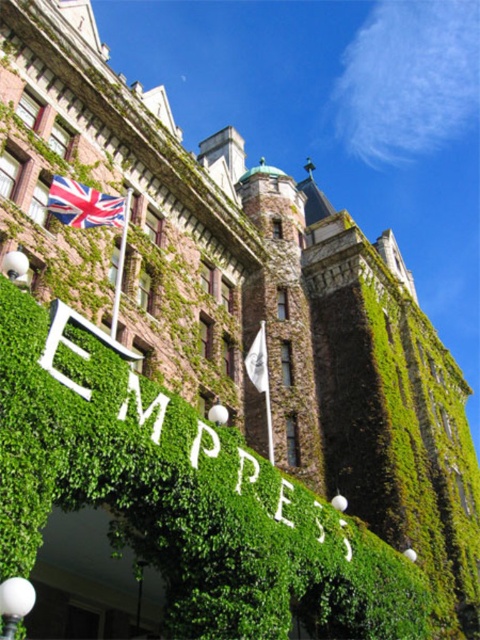
You are standing in front of the historic building and want to hang a new flag between the union jack fabric flag at upper left and the white fabric flag at center. The new flag requires a space of 2 meters. Is there enough space between them?

The union jack fabric flag at upper left and white fabric flag at center are 18.01 meters apart from each other, so yes, there is enough space between them to hang the new flag requiring 2 meters.

You are standing in front of the historic building and notice two flags. The union jack fabric flag at upper left and the white fabric flag at center. Which flag is shorter in height?

The union jack fabric flag at upper left has a lesser height compared to the white fabric flag at center, so the union jack fabric flag at upper left is shorter.

You are standing in front of the historic building and notice two points marked on its facade. The first point is at coordinates point (54,212) and the second is at point (264,330). Which point is closer to you?

Point (54,212) is closer to the viewer than point (264,330).